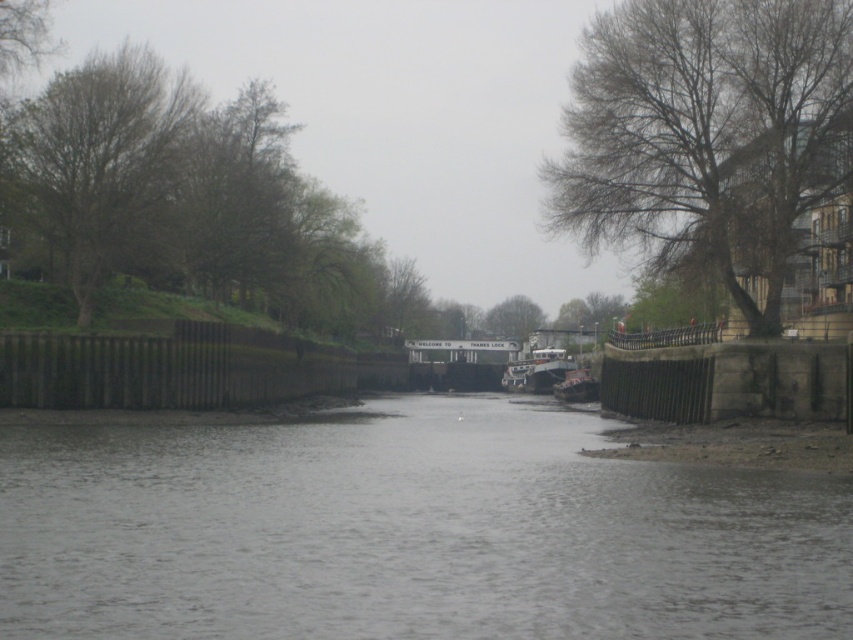
In order to click on gray concrete river at center in this screenshot , I will do `click(408, 532)`.